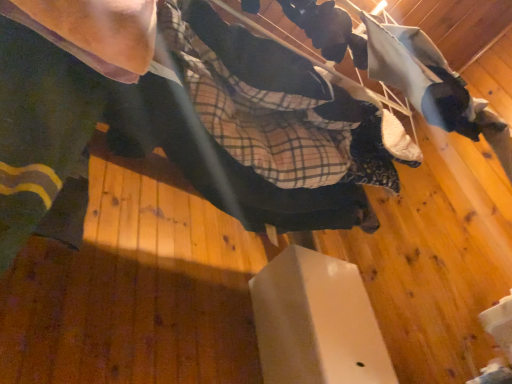
Question: Considering the relative sizes of matte black arm at upper left and matte black skateboard at center in the image provided, is matte black arm at upper left wider than matte black skateboard at center?

Choices:
 (A) no
 (B) yes

Answer: (A)

Question: Is matte black arm at upper left facing towards matte black skateboard at center?

Choices:
 (A) no
 (B) yes

Answer: (A)

Question: Would you say matte black arm at upper left is a long distance from matte black skateboard at center?

Choices:
 (A) yes
 (B) no

Answer: (B)

Question: Is matte black arm at upper left positioned beyond the bounds of matte black skateboard at center?

Choices:
 (A) yes
 (B) no

Answer: (A)

Question: Is matte black arm at upper left at the left side of matte black skateboard at center?

Choices:
 (A) no
 (B) yes

Answer: (B)

Question: Can you confirm if matte black arm at upper left is smaller than matte black skateboard at center?

Choices:
 (A) yes
 (B) no

Answer: (A)

Question: From a real-world perspective, is fluffy white blanket at upper right located beneath white matte box at center?

Choices:
 (A) yes
 (B) no

Answer: (B)

Question: Is fluffy white blanket at upper right further to the viewer compared to white matte box at center?

Choices:
 (A) yes
 (B) no

Answer: (B)

Question: Does fluffy white blanket at upper right have a larger size compared to white matte box at center?

Choices:
 (A) no
 (B) yes

Answer: (A)

Question: Is fluffy white blanket at upper right positioned with its back to white matte box at center?

Choices:
 (A) yes
 (B) no

Answer: (A)

Question: Does fluffy white blanket at upper right turn towards white matte box at center?

Choices:
 (A) yes
 (B) no

Answer: (B)

Question: Can you confirm if fluffy white blanket at upper right is taller than white matte box at center?

Choices:
 (A) no
 (B) yes

Answer: (A)

Question: Is fluffy white blanket at upper right positioned in front of matte black skateboard at center?

Choices:
 (A) yes
 (B) no

Answer: (B)